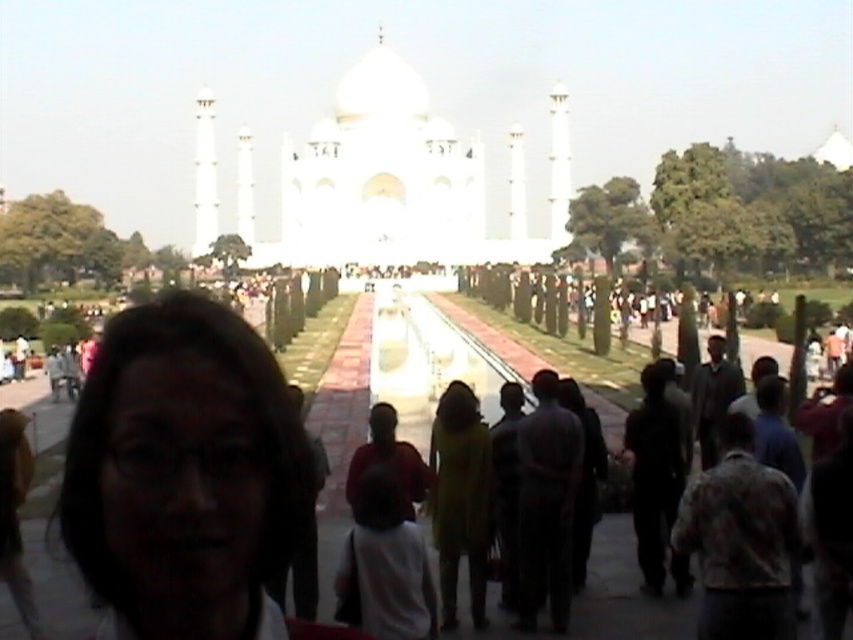
Question: Is matte black hair at lower left bigger than white marble palace at center?

Choices:
 (A) yes
 (B) no

Answer: (B)

Question: Where is matte black hair at lower left located in relation to white marble palace at center in the image?

Choices:
 (A) right
 (B) left

Answer: (B)

Question: Which of the following is the farthest from the observer?

Choices:
 (A) matte black hair at lower left
 (B) white marble palace at center

Answer: (B)

Question: Where is matte black hair at lower left located in relation to white marble palace at center in the image?

Choices:
 (A) above
 (B) below

Answer: (B)

Question: Which point appears closest to the camera in this image?

Choices:
 (A) (525, 186)
 (B) (285, 515)

Answer: (B)